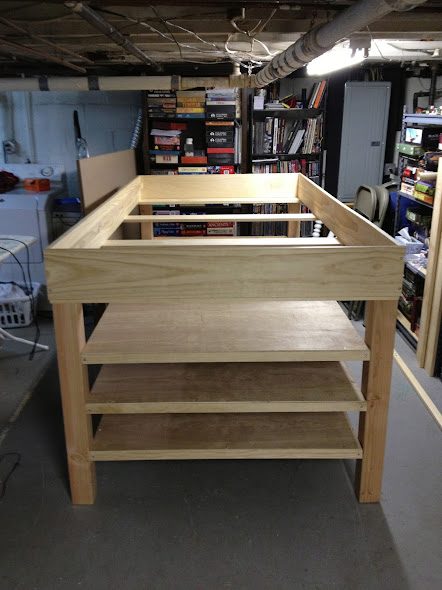
Identify the location of wooden board. [x=271, y=389].